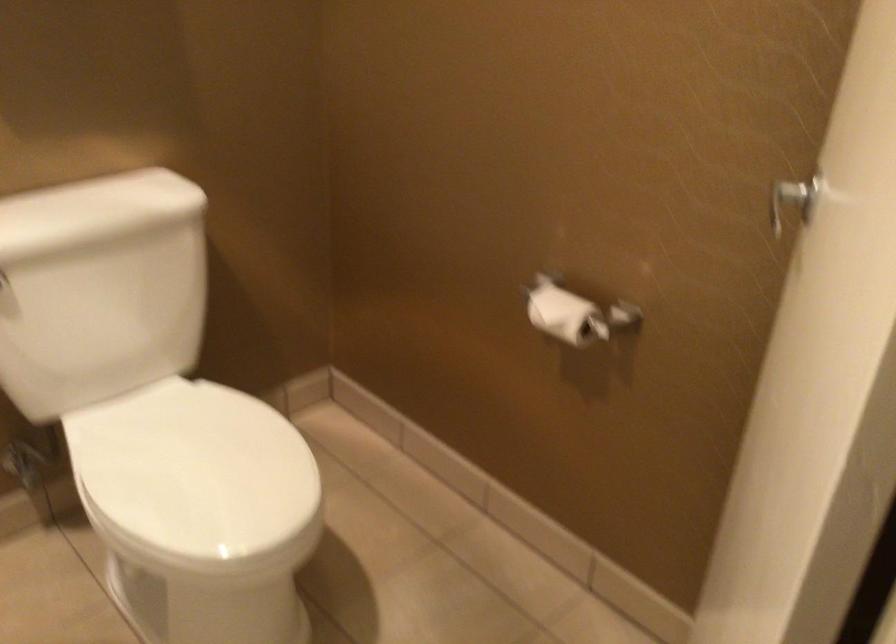
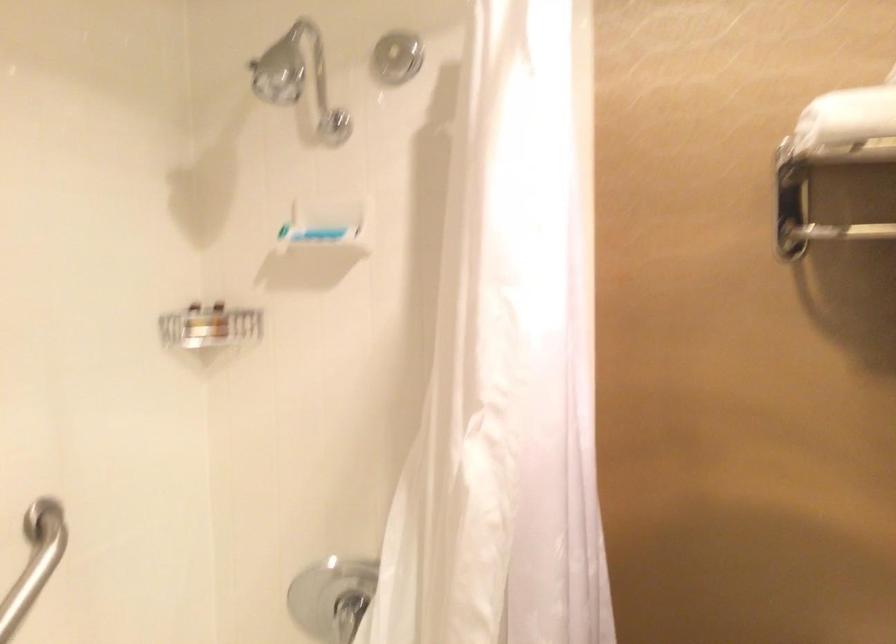
Question: The images are taken continuously from a first-person perspective. In which direction is your viewpoint rotating?

Choices:
 (A) Left
 (B) Right
 (C) Up
 (D) Down

Answer: (A)